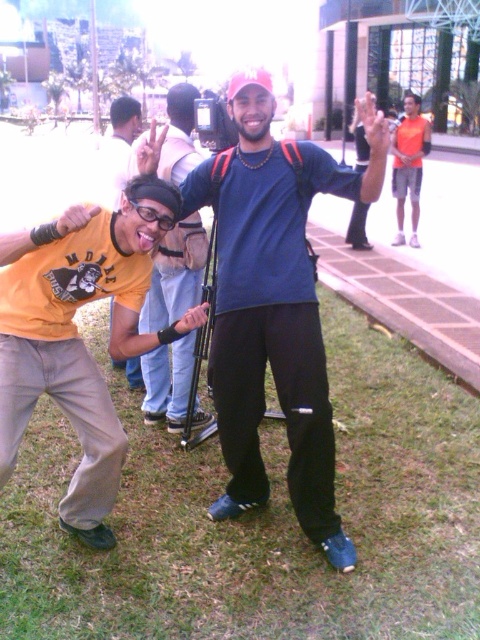
Question: Among these objects, which one is farthest from the camera?

Choices:
 (A) yellow matte t-shirt at lower left
 (B) matte yellow t-shirt at center
 (C) blue matte shirt at center

Answer: (B)

Question: Which of the following is the closest to the observer?

Choices:
 (A) pos(193,339)
 (B) pos(120,243)
 (C) pos(261,497)
 (D) pos(127,104)

Answer: (B)

Question: Can you confirm if blue matte shirt at center is thinner than matte yellow t-shirt at left?

Choices:
 (A) no
 (B) yes

Answer: (A)

Question: Observing the image, what is the correct spatial positioning of blue matte shirt at center in reference to yellow matte t-shirt at lower left?

Choices:
 (A) below
 (B) above

Answer: (B)

Question: Where is blue matte shirt at center located in relation to matte yellow t-shirt at left in the image?

Choices:
 (A) above
 (B) below

Answer: (B)

Question: Based on their relative distances, which object is farther from the yellow matte t-shirt at lower left?

Choices:
 (A) matte yellow t-shirt at center
 (B) blue matte shirt at center
 (C) orange mesh shirt at upper right

Answer: (C)